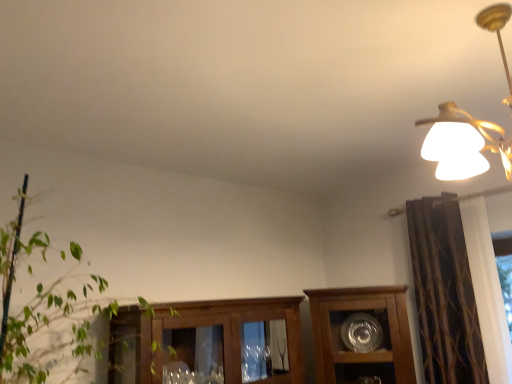
Question: Is brown textured curtain at right at the back of wooden cabinet at center?

Choices:
 (A) no
 (B) yes

Answer: (A)

Question: Can you confirm if wooden cabinet at center is positioned to the left of brown textured curtain at right?

Choices:
 (A) yes
 (B) no

Answer: (A)

Question: Would you say wooden cabinet at center is a long distance from brown textured curtain at right?

Choices:
 (A) no
 (B) yes

Answer: (A)

Question: Is wooden cabinet at center positioned in front of brown textured curtain at right?

Choices:
 (A) no
 (B) yes

Answer: (A)

Question: From the image's perspective, is wooden cabinet at center beneath brown textured curtain at right?

Choices:
 (A) no
 (B) yes

Answer: (B)

Question: From their relative heights in the image, would you say matte gold chandelier at upper right is taller or shorter than brown textured curtain at right?

Choices:
 (A) short
 (B) tall

Answer: (A)

Question: Looking at their shapes, would you say matte gold chandelier at upper right is wider or thinner than brown textured curtain at right?

Choices:
 (A) wide
 (B) thin

Answer: (A)

Question: Would you say matte gold chandelier at upper right is inside or outside brown textured curtain at right?

Choices:
 (A) inside
 (B) outside

Answer: (B)

Question: From a real-world perspective, is matte gold chandelier at upper right above or below brown textured curtain at right?

Choices:
 (A) below
 (B) above

Answer: (B)

Question: Does point (497, 26) appear closer or farther from the camera than point (390, 331)?

Choices:
 (A) closer
 (B) farther

Answer: (A)

Question: Choose the correct answer: Is matte gold chandelier at upper right inside wooden cabinet at center or outside it?

Choices:
 (A) outside
 (B) inside

Answer: (A)

Question: From the image's perspective, relative to wooden cabinet at center, is matte gold chandelier at upper right above or below?

Choices:
 (A) below
 (B) above

Answer: (B)

Question: Considering the positions of matte gold chandelier at upper right and wooden cabinet at center in the image, is matte gold chandelier at upper right wider or thinner than wooden cabinet at center?

Choices:
 (A) wide
 (B) thin

Answer: (A)

Question: Looking at their shapes, would you say wooden cabinet at center is wider or thinner than green leafy plant at left?

Choices:
 (A) wide
 (B) thin

Answer: (B)

Question: Considering the relative positions of wooden cabinet at center and green leafy plant at left in the image provided, is wooden cabinet at center to the left or to the right of green leafy plant at left?

Choices:
 (A) left
 (B) right

Answer: (B)